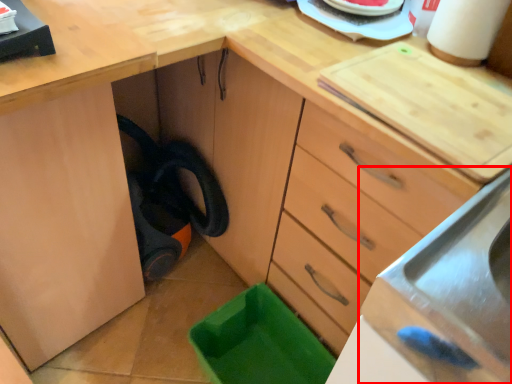
Question: From the image's perspective, what is the correct spatial relationship of sink (annotated by the red box) in relation to paper towel?

Choices:
 (A) above
 (B) below

Answer: (B)